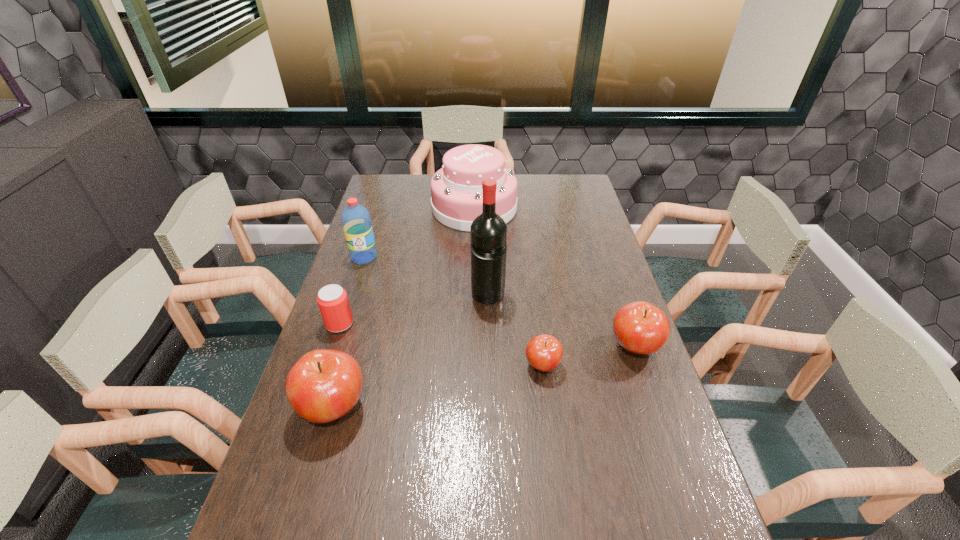
To make them evenly spaced by inserting another apple among them, please locate a free space for this new apple. Please provide its 2D coordinates. Your answer should be formatted as a tuple, i.e. [(x, y)], where the tuple contains the x and y coordinates of a point satisfying the conditions above.

[(443, 385)]